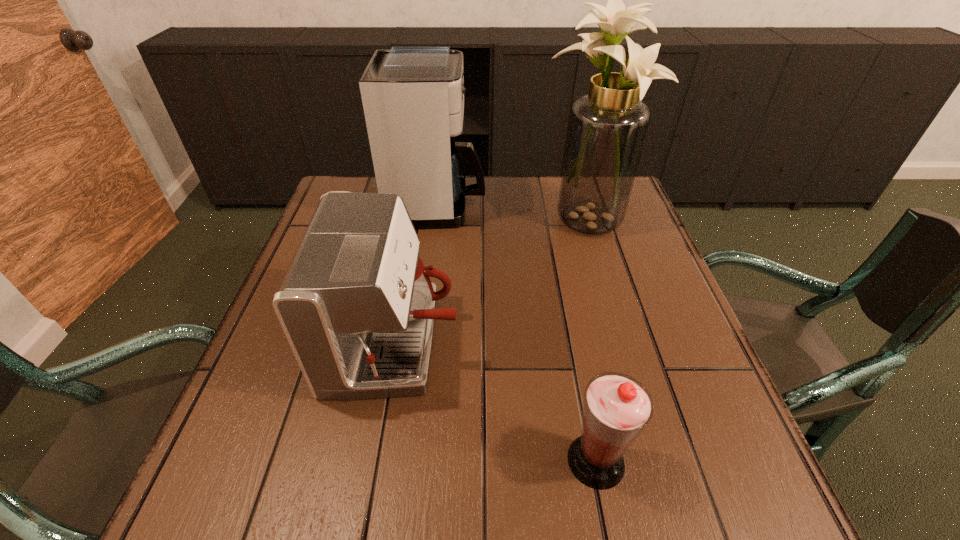
This screenshot has height=540, width=960. I want to click on free point located on the left of the nearest object, so click(x=507, y=461).

Locate an element on the screen. This screenshot has height=540, width=960. flower arrangement that is at the far edge is located at coordinates (607, 128).

Find the location of a particular element. coffee maker at the far edge is located at coordinates click(x=413, y=96).

Find the location of `object that is at the near edge`. object that is at the near edge is located at coordinates (617, 407).

Find the location of a particular element. Image resolution: width=960 pixels, height=540 pixels. object positioned at the left edge is located at coordinates (357, 306).

This screenshot has height=540, width=960. What are the coordinates of `object that is at the right edge` in the screenshot? It's located at (607, 128).

Identify the location of object that is at the far right corner. [x=607, y=128].

Locate an element on the screen. This screenshot has height=540, width=960. vacant space at the far edge is located at coordinates (488, 204).

Where is `free space at the near edge of the desktop`? free space at the near edge of the desktop is located at coordinates (386, 492).

Find the location of a particular element. This screenshot has height=540, width=960. vacant area at the left edge is located at coordinates (257, 441).